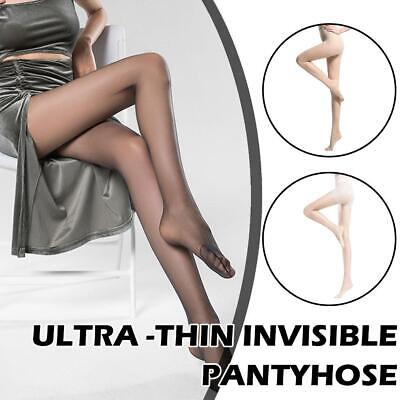
Where is `chair leg`? The height and width of the screenshot is (400, 400). chair leg is located at coordinates (131, 289).